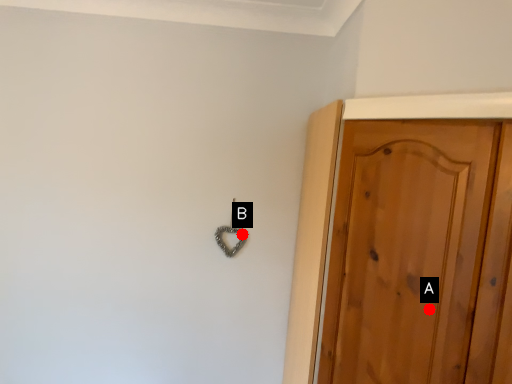
Question: Two points are circled on the image, labeled by A and B beside each circle. Which point is closer to the camera?

Choices:
 (A) A is closer
 (B) B is closer

Answer: (A)